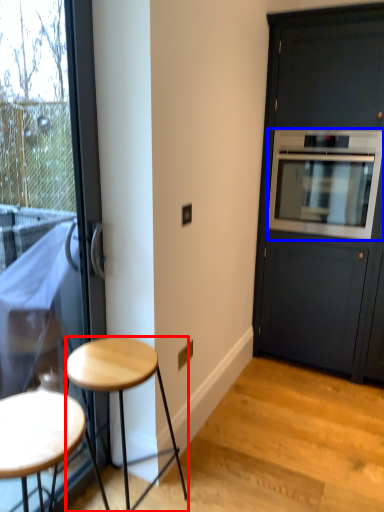
Question: Which object is closer to the camera taking this photo, stool (highlighted by a red box) or oven (highlighted by a blue box)?

Choices:
 (A) stool
 (B) oven

Answer: (A)